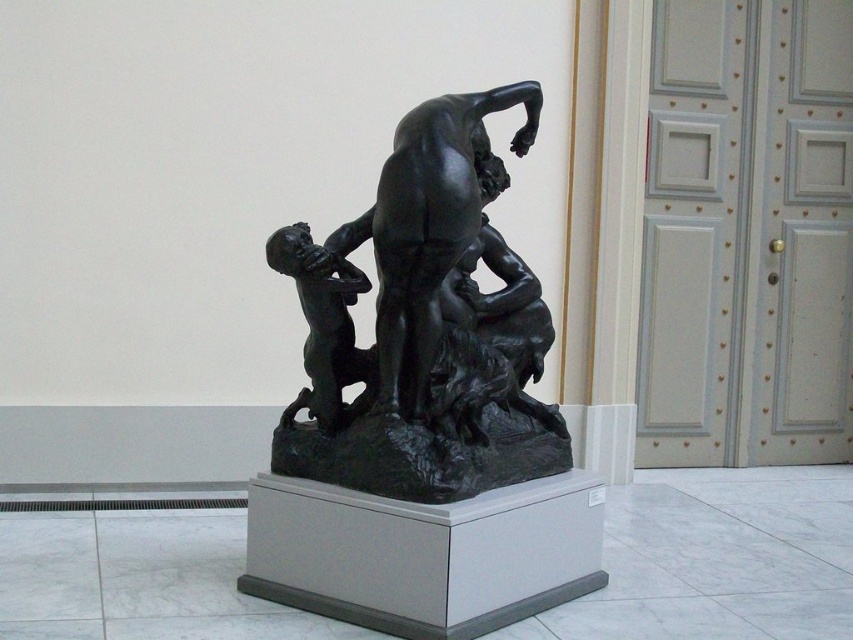
Between black polished bronze sculpture at center and matte black figure at center-left, which one has more height?

black polished bronze sculpture at center

Does point (381, 348) come behind point (305, 257)?

Yes, point (381, 348) is farther from viewer.

This screenshot has width=853, height=640. What are the coordinates of `black polished bronze sculpture at center` in the screenshot? It's located at (424, 324).